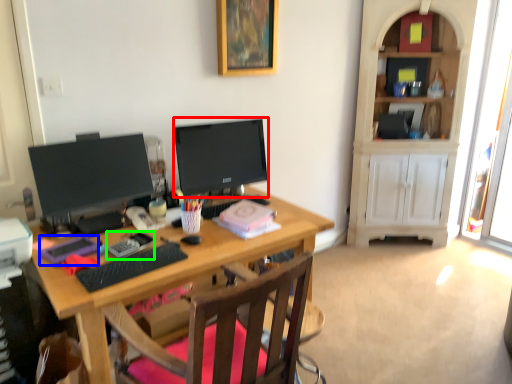
Question: Which object is the closest to the television (highlighted by a red box)? Choose among these: stationery (highlighted by a blue box) or stationery (highlighted by a green box).

Choices:
 (A) stationery
 (B) stationery

Answer: (B)